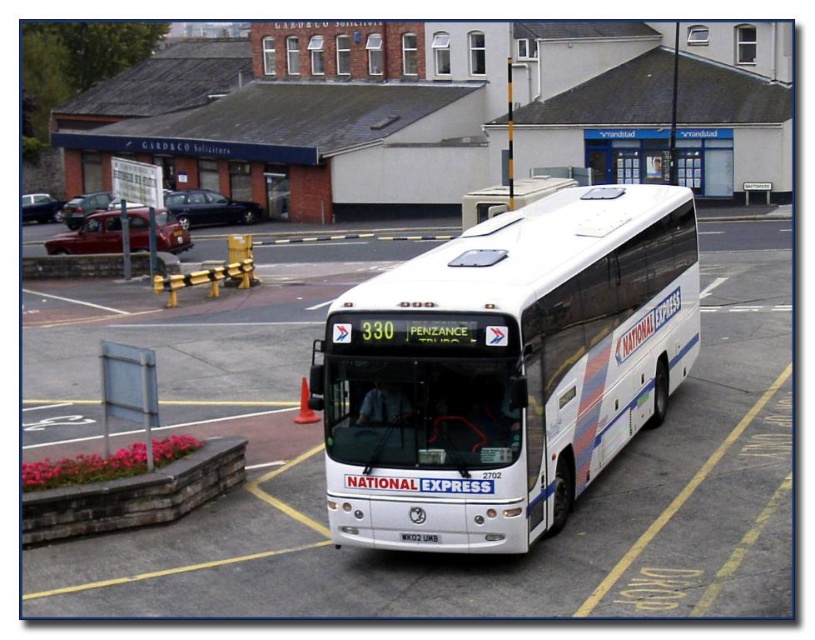
Who is higher up, white glossy/decorative bus at center or black plastic license plate at center?

white glossy/decorative bus at center

Does white glossy/decorative bus at center have a larger size compared to black plastic license plate at center?

Indeed, white glossy/decorative bus at center has a larger size compared to black plastic license plate at center.

Which is in front, point (523, 452) or point (413, 532)?

Point (523, 452)

This screenshot has height=640, width=815. Identify the location of white glossy/decorative bus at center. (505, 369).